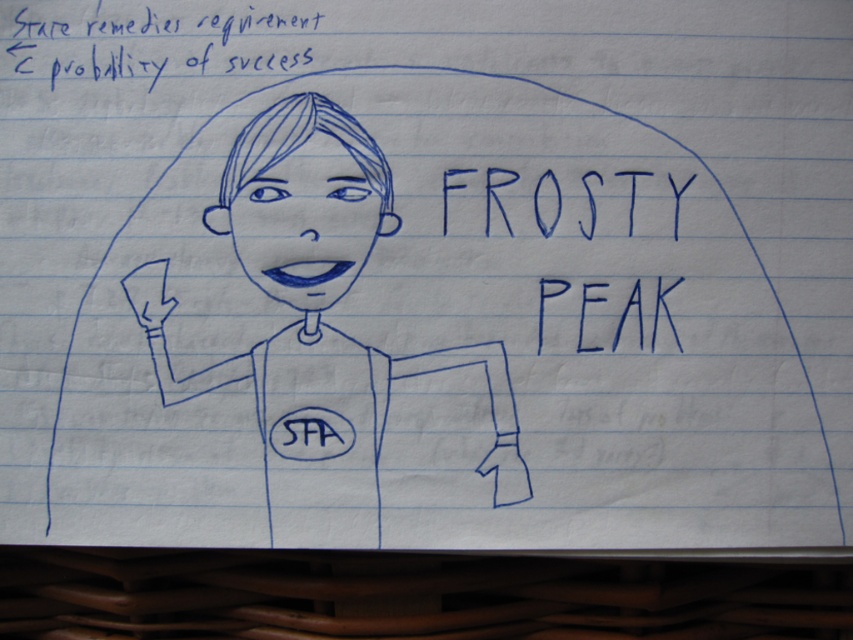
Is blue line drawing girl at center shorter than blue handwritten text at upper center?

Incorrect, blue line drawing girl at center's height does not fall short of blue handwritten text at upper center's.

Is point (218, 209) in front of point (579, 304)?

No.

At what (x,y) coordinates should I click in order to perform the action: click on blue line drawing girl at center. Please return your answer as a coordinate pair (x, y). The image size is (853, 640). Looking at the image, I should click on (318, 324).

Does blue handwritten text at upper center have a greater height compared to blue ink writing at upper left?

Indeed, blue handwritten text at upper center has a greater height compared to blue ink writing at upper left.

Is point (699, 248) closer to camera compared to point (3, 70)?

Yes.

Where is `blue handwritten text at upper center`? blue handwritten text at upper center is located at coordinates (573, 253).

Does blue line drawing girl at center have a smaller size compared to blue ink writing at upper left?

No, blue line drawing girl at center is not smaller than blue ink writing at upper left.

You are a GUI agent. You are given a task and a screenshot of the screen. Output one action in this format:
    pyautogui.click(x=<x>, y=<y>)
    Task: Click on the blue line drawing girl at center
    
    Given the screenshot: What is the action you would take?
    pyautogui.click(x=318, y=324)

The image size is (853, 640). Find the location of `blue line drawing girl at center`. blue line drawing girl at center is located at coordinates click(x=318, y=324).